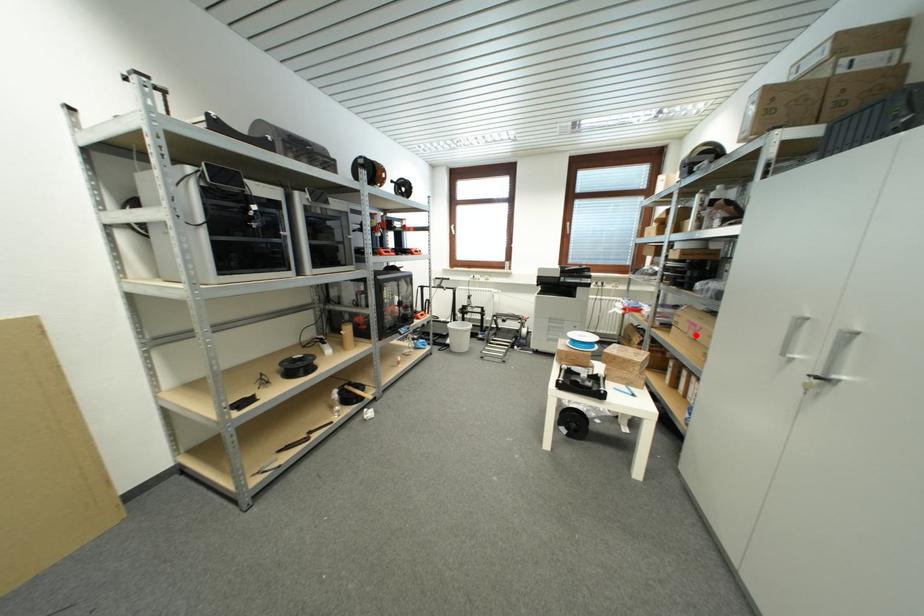
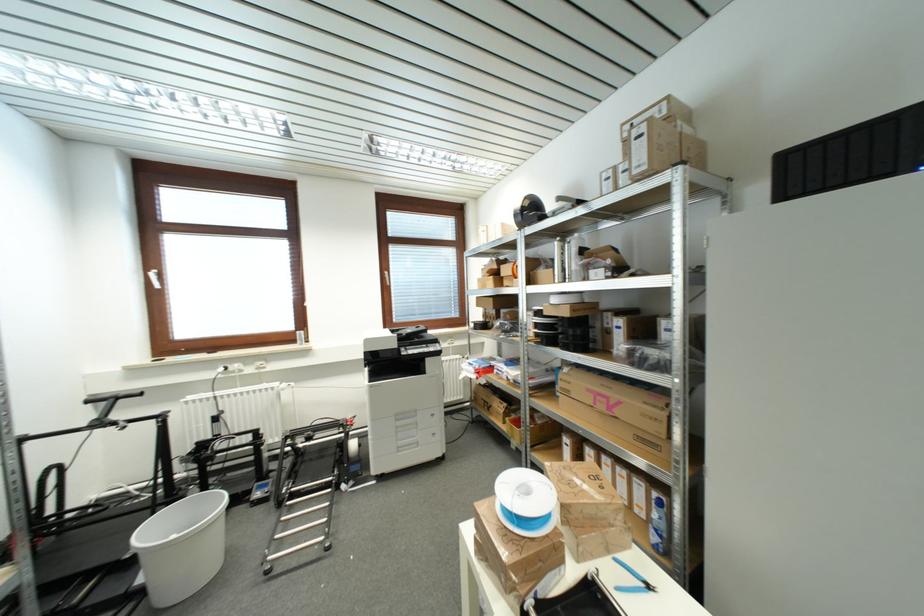
Question: I am providing you with two images of the same scene from different viewpoints. A red point is marked on the first image. Can you still see the location of the red point in image 2?

Choices:
 (A) Yes
 (B) No

Answer: (A)